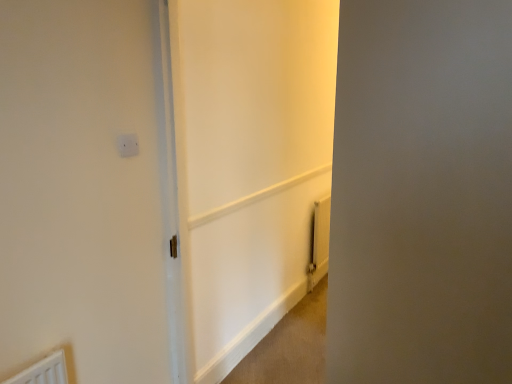
Question: In which direction should I rotate to look at white plastic electric outlet at upper center?

Choices:
 (A) left
 (B) right

Answer: (A)

Question: Is white plastic electric outlet at upper center not near yellow metallic radiator at lower right?

Choices:
 (A) yes
 (B) no

Answer: (A)

Question: Considering the relative sizes of white plastic electric outlet at upper center and yellow metallic radiator at lower right in the image provided, is white plastic electric outlet at upper center bigger than yellow metallic radiator at lower right?

Choices:
 (A) yes
 (B) no

Answer: (B)

Question: Can you confirm if white plastic electric outlet at upper center is smaller than yellow metallic radiator at lower right?

Choices:
 (A) no
 (B) yes

Answer: (B)

Question: Is white plastic electric outlet at upper center oriented towards yellow metallic radiator at lower right?

Choices:
 (A) yes
 (B) no

Answer: (B)

Question: Would you say yellow metallic radiator at lower right is part of white plastic electric outlet at upper center's contents?

Choices:
 (A) no
 (B) yes

Answer: (A)

Question: Is white plastic electric outlet at upper center not inside yellow metallic radiator at lower right?

Choices:
 (A) no
 (B) yes

Answer: (B)

Question: From a real-world perspective, is white glossy door at center, placed as the 2th screen door when sorted from right to left, beneath white matte screen door at right, the 2th screen door from the left?

Choices:
 (A) yes
 (B) no

Answer: (A)

Question: Does white glossy door at center, placed as the 2th screen door when sorted from right to left, have a larger size compared to white matte screen door at right, the 2th screen door from the left?

Choices:
 (A) yes
 (B) no

Answer: (A)

Question: Is white glossy door at center, which is the 1th screen door in left-to-right order, to the left of white matte screen door at right, the 2th screen door from the left, from the viewer's perspective?

Choices:
 (A) no
 (B) yes

Answer: (B)

Question: Is white glossy door at center, which is the 1th screen door in left-to-right order, in contact with white matte screen door at right, the 1th screen door positioned from the right?

Choices:
 (A) yes
 (B) no

Answer: (B)

Question: Can you confirm if white glossy door at center, placed as the 2th screen door when sorted from right to left, is shorter than white matte screen door at right, the 2th screen door from the left?

Choices:
 (A) no
 (B) yes

Answer: (A)

Question: Is white glossy door at center, which is the 1th screen door in left-to-right order, positioned with its back to white matte screen door at right, the 2th screen door from the left?

Choices:
 (A) no
 (B) yes

Answer: (A)

Question: From a real-world perspective, is white plastic electric outlet at upper center physically above white glossy door at center, which is the 1th screen door in left-to-right order?

Choices:
 (A) yes
 (B) no

Answer: (A)